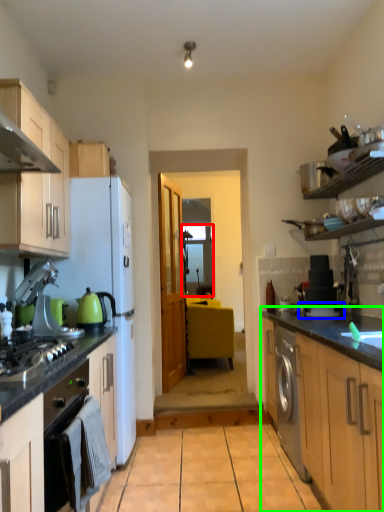
Question: Which is farther away from glass door (highlighted by a red box)? appliance (highlighted by a blue box) or counter (highlighted by a green box)?

Choices:
 (A) appliance
 (B) counter

Answer: (B)